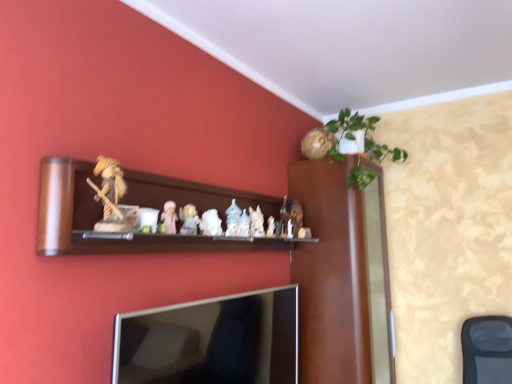
Question: From the image's perspective, is porcelain figurine at center, the second toy when ordered from left to right, under silver metallic tv at lower center?

Choices:
 (A) no
 (B) yes

Answer: (A)

Question: Is porcelain figurine at center, arranged as the fifth toy when viewed from the right, not within silver metallic tv at lower center?

Choices:
 (A) no
 (B) yes

Answer: (B)

Question: Does porcelain figurine at center, the second toy when ordered from left to right, turn towards silver metallic tv at lower center?

Choices:
 (A) yes
 (B) no

Answer: (B)

Question: Considering the relative sizes of porcelain figurine at center, the second toy when ordered from left to right, and silver metallic tv at lower center in the image provided, is porcelain figurine at center, the second toy when ordered from left to right, smaller than silver metallic tv at lower center?

Choices:
 (A) no
 (B) yes

Answer: (B)

Question: Is porcelain figurine at center, the second toy when ordered from left to right, touching silver metallic tv at lower center?

Choices:
 (A) yes
 (B) no

Answer: (B)

Question: Is point (186, 215) closer or farther from the camera than point (60, 223)?

Choices:
 (A) closer
 (B) farther

Answer: (B)

Question: Considering their positions, is white porcelain figurines at center, placed as the fourth toy when sorted from back to front, located in front of or behind wooden shelf at center?

Choices:
 (A) front
 (B) behind

Answer: (B)

Question: Choose the correct answer: Is white porcelain figurines at center, the fourth toy from the right, inside wooden shelf at center or outside it?

Choices:
 (A) inside
 (B) outside

Answer: (A)

Question: Is white porcelain figurines at center, acting as the 3th toy starting from the front, taller or shorter than wooden shelf at center?

Choices:
 (A) tall
 (B) short

Answer: (B)

Question: Is green leafy plant at upper right inside the boundaries of wooden shelf at center, or outside?

Choices:
 (A) inside
 (B) outside

Answer: (B)

Question: Looking at their shapes, would you say green leafy plant at upper right is wider or thinner than wooden shelf at center?

Choices:
 (A) wide
 (B) thin

Answer: (A)

Question: In terms of height, does green leafy plant at upper right look taller or shorter compared to wooden shelf at center?

Choices:
 (A) tall
 (B) short

Answer: (A)

Question: Is green leafy plant at upper right to the left or to the right of wooden shelf at center in the image?

Choices:
 (A) right
 (B) left

Answer: (A)

Question: Is wooden shelf at center taller or shorter than silver metallic tv at lower center?

Choices:
 (A) short
 (B) tall

Answer: (A)

Question: Considering the positions of point (53, 195) and point (211, 380), is point (53, 195) closer or farther from the camera than point (211, 380)?

Choices:
 (A) closer
 (B) farther

Answer: (A)